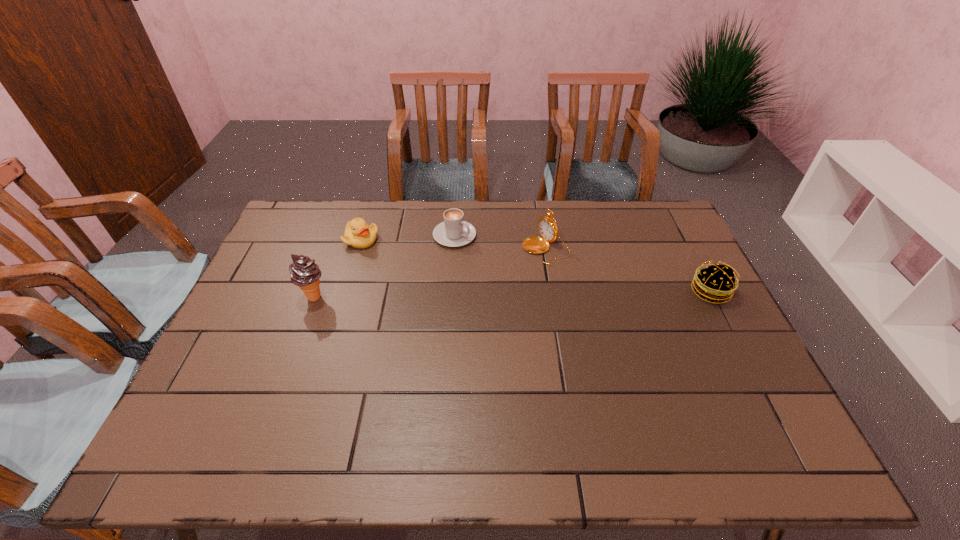
I want to click on vacant space that's between the duckling and the third object from left to right, so click(408, 238).

Locate an element on the screen. Image resolution: width=960 pixels, height=540 pixels. empty space that is in between the duckling and the patty is located at coordinates (536, 266).

The width and height of the screenshot is (960, 540). I want to click on vacant area between the third object from right to left and the tallest object, so click(384, 266).

You are a GUI agent. You are given a task and a screenshot of the screen. Output one action in this format:
    pyautogui.click(x=<x>, y=<y>)
    Task: Click on the vacant area that lies between the rightmost object and the icecream
    This screenshot has width=960, height=540.
    Given the screenshot: What is the action you would take?
    pyautogui.click(x=512, y=294)

At what (x,y) coordinates should I click in order to perform the action: click on vacant area between the patty and the duckling. Please return your answer as a coordinate pair (x, y). This screenshot has width=960, height=540. Looking at the image, I should click on (536, 266).

You are a GUI agent. You are given a task and a screenshot of the screen. Output one action in this format:
    pyautogui.click(x=<x>, y=<y>)
    Task: Click on the object that can be found as the third closest to the patty
    The image size is (960, 540).
    Given the screenshot: What is the action you would take?
    pyautogui.click(x=358, y=234)

Locate an element on the screen. object that is the closest to the patty is located at coordinates (548, 228).

Where is `free space that satisfies the following two spatial constraints: 1. on the back side of the icecream; 2. on the left side of the duckling`? The width and height of the screenshot is (960, 540). free space that satisfies the following two spatial constraints: 1. on the back side of the icecream; 2. on the left side of the duckling is located at coordinates (335, 240).